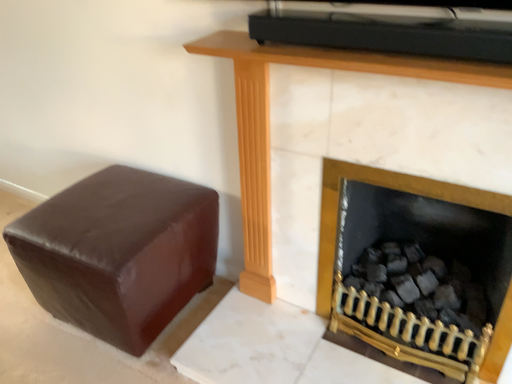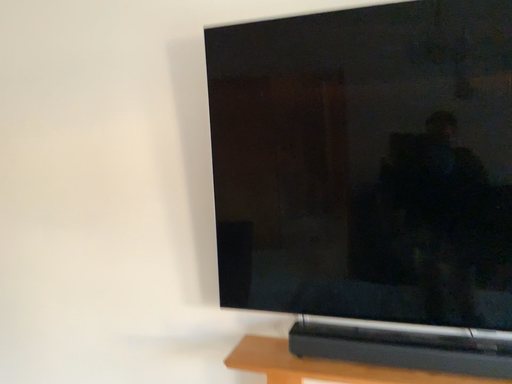
Question: How did the camera likely rotate when shooting the video?

Choices:
 (A) rotated right
 (B) rotated left

Answer: (A)